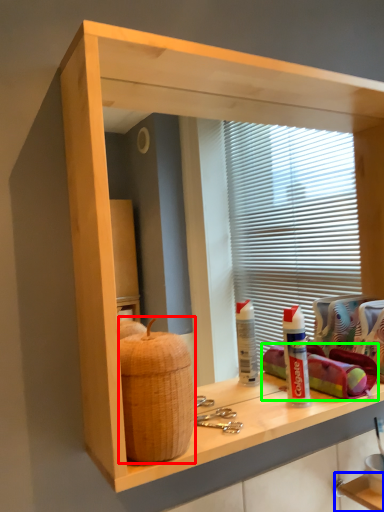
Question: Estimate the real-world distances between objects in this image. Which object is farther from basket (highlighted by a red box), shelf (highlighted by a blue box) or material (highlighted by a green box)?

Choices:
 (A) shelf
 (B) material

Answer: (A)